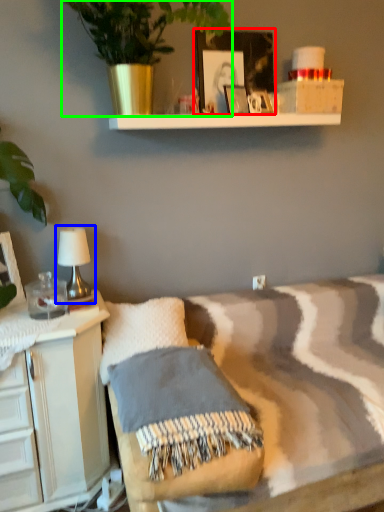
Question: Which object is the farthest from picture frame (highlighted by a red box)? Choose among these: table lamp (highlighted by a blue box) or houseplant (highlighted by a green box).

Choices:
 (A) table lamp
 (B) houseplant

Answer: (A)